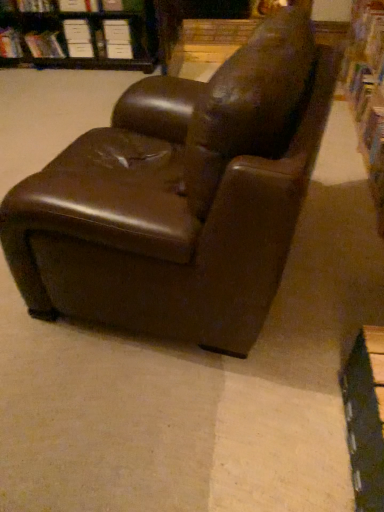
This screenshot has width=384, height=512. What do you see at coordinates (77, 31) in the screenshot?
I see `white paper at upper left, placed as the 4th paperback book when sorted from right to left` at bounding box center [77, 31].

In order to face white paper at upper left, placed as the 4th paperback book when sorted from right to left, should I rotate leftwards or rightwards?

You should look left and rotate roughly 15.010 degrees.

The height and width of the screenshot is (512, 384). Describe the element at coordinates (119, 51) in the screenshot. I see `white paper at upper center, which is the first paperback book from right to left` at that location.

Measure the distance between point (118,57) and camera.

They are 3.65 meters apart.

Where is `brown leather bookcase at upper left`? brown leather bookcase at upper left is located at coordinates (79, 34).

Image resolution: width=384 pixels, height=512 pixels. In order to click on brown leather chair at center in this screenshot , I will do `click(180, 197)`.

What is the approximate width of white paper at upper left, positioned as the 3th paperback book in right-to-left order?

white paper at upper left, positioned as the 3th paperback book in right-to-left order, is 4.79 inches wide.

This screenshot has height=512, width=384. In order to click on white paper at upper left, which is the 1th paperback book from left to right in this screenshot , I will do `click(77, 31)`.

Is brown leather bookcase at upper left taller than hardcover book at upper left, the 3th book from the front?

Yes, brown leather bookcase at upper left is taller than hardcover book at upper left, the 3th book from the front.

From the image's perspective, is brown leather bookcase at upper left below hardcover book at upper left, which appears as the 3th book when viewed from the top?

Incorrect, from the image's perspective, brown leather bookcase at upper left is higher than hardcover book at upper left, which appears as the 3th book when viewed from the top.

From a real-world perspective, is brown leather bookcase at upper left located beneath hardcover book at upper left, which appears as the 3th book when viewed from the top?

No.

Which of these two, brown leather bookcase at upper left or hardcover book at upper left, which appears as the 2th book when viewed from the left, is smaller?

hardcover book at upper left, which appears as the 2th book when viewed from the left, is smaller.

Based on their sizes in the image, would you say hardcover book at upper right, the 1th book in the bottom-to-top sequence, is bigger or smaller than brown leather bookcase at upper left?

hardcover book at upper right, the 1th book in the bottom-to-top sequence, is smaller than brown leather bookcase at upper left.

Can you confirm if hardcover book at upper right, the 1th book in the bottom-to-top sequence, is positioned to the right of brown leather bookcase at upper left?

Correct, you'll find hardcover book at upper right, the 1th book in the bottom-to-top sequence, to the right of brown leather bookcase at upper left.

Could you measure the distance between hardcover book at upper right, the first book in the front-to-back sequence, and brown leather bookcase at upper left?

6.69 feet.

What's the angular difference between hardcover book at upper right, which is the 4th book from top to bottom, and brown leather bookcase at upper left's facing directions?

The facing directions of hardcover book at upper right, which is the 4th book from top to bottom, and brown leather bookcase at upper left are 90.3 degrees apart.

Which object is wider, white paper book at upper left, arranged as the 4th book when viewed from the front, or hardcover book at upper left, the 3th book from the front?

With larger width is white paper book at upper left, arranged as the 4th book when viewed from the front.

Can you confirm if white paper book at upper left, which is counted as the second book, starting from the top, is positioned to the left of hardcover book at upper left, the 3th book from the front?

Indeed, white paper book at upper left, which is counted as the second book, starting from the top, is positioned on the left side of hardcover book at upper left, the 3th book from the front.

Which of these two, white paper book at upper left, which is counted as the second book, starting from the top, or hardcover book at upper left, the 3th book from the front, stands taller?

white paper book at upper left, which is counted as the second book, starting from the top, is taller.

Is white paper book at upper left, arranged as the 4th book when viewed from the front, facing away from hardcover book at upper left, positioned as the 2th book in back-to-front order?

white paper book at upper left, arranged as the 4th book when viewed from the front, does not have its back to hardcover book at upper left, positioned as the 2th book in back-to-front order.

Considering the relative sizes of white paper at upper left, which is the 1th paperback book from left to right, and hardcover book at upper left, which appears as the 2th book when viewed from the left, in the image provided, is white paper at upper left, which is the 1th paperback book from left to right, wider than hardcover book at upper left, which appears as the 2th book when viewed from the left,?

No, white paper at upper left, which is the 1th paperback book from left to right, is not wider than hardcover book at upper left, which appears as the 2th book when viewed from the left.

Is white paper at upper left, placed as the 4th paperback book when sorted from right to left, turned away from hardcover book at upper left, the 3th book from the front?

white paper at upper left, placed as the 4th paperback book when sorted from right to left, does not have its back to hardcover book at upper left, the 3th book from the front.

From a real-world perspective, which object rests below the other?

In real-world perspective, hardcover book at upper left, which appears as the 2th book when viewed from the left, is lower.

Is hardcover book at upper left, which appears as the second book when ordered from the bottom, located within white paper at upper left, placed as the 4th paperback book when sorted from right to left?

Definitely not — hardcover book at upper left, which appears as the second book when ordered from the bottom, is not inside white paper at upper left, placed as the 4th paperback book when sorted from right to left.

Between white paper at upper left, which is the 1th paperback book from left to right, and white paper at upper center, marked as the third paperback book in a left-to-right arrangement, which one is positioned in front?

white paper at upper center, marked as the third paperback book in a left-to-right arrangement, is more forward.

Is point (63, 24) positioned after point (116, 33)?

That is True.

Are white paper at upper left, placed as the 4th paperback book when sorted from right to left, and white paper at upper center, placed as the 2th paperback book when sorted from right to left, far apart?

That's not correct — white paper at upper left, placed as the 4th paperback book when sorted from right to left, is a little close to white paper at upper center, placed as the 2th paperback book when sorted from right to left.

Is white paper at upper center, placed as the 2th paperback book when sorted from right to left, located within white paper at upper left, placed as the 4th paperback book when sorted from right to left?

That's incorrect, white paper at upper center, placed as the 2th paperback book when sorted from right to left, is not inside white paper at upper left, placed as the 4th paperback book when sorted from right to left.

Between hardcover book at upper left, which is the third book from right to left, and brown leather chair at center, which one appears on the right side from the viewer's perspective?

Positioned to the right is brown leather chair at center.

Is hardcover book at upper left, the 3th book from the front, facing towards brown leather chair at center?

No, hardcover book at upper left, the 3th book from the front, does not turn towards brown leather chair at center.

From a real-world perspective, is hardcover book at upper left, which appears as the 3th book when viewed from the top, over brown leather chair at center?

No.

Looking at this image, can you confirm if white paper at upper center, marked as the third paperback book in a left-to-right arrangement, is taller than hardcover book at upper left, arranged as the third book when viewed from the back?

Yes, white paper at upper center, marked as the third paperback book in a left-to-right arrangement, is taller than hardcover book at upper left, arranged as the third book when viewed from the back.

How different are the orientations of white paper at upper center, placed as the 2th paperback book when sorted from right to left, and hardcover book at upper left, which appears as the second book when viewed from the front, in degrees?

2.41 degrees separate the facing orientations of white paper at upper center, placed as the 2th paperback book when sorted from right to left, and hardcover book at upper left, which appears as the second book when viewed from the front.

Is point (122, 40) more distant than point (37, 12)?

Yes, point (122, 40) is farther from viewer.

Is white paper at upper center, placed as the 2th paperback book when sorted from right to left, positioned far away from hardcover book at upper left, marked as the second book in a right-to-left arrangement?

Actually, white paper at upper center, placed as the 2th paperback book when sorted from right to left, and hardcover book at upper left, marked as the second book in a right-to-left arrangement, are a little close together.

From the image's perspective, count 2nd books downward from the brown leather bookcase at upper left and point to it. Please provide its 2D coordinates.

[(44, 45)]

In the image, there is a hardcover book at upper right, the 1th book in the bottom-to-top sequence. At what (x,y) coordinates should I click in order to perform the action: click on bookcase above it (from the image's perspective). Please return your answer as a coordinate pair (x, y). Looking at the image, I should click on 79,34.

Looking at the image, which one is located further to white paper at upper left, which is the 1th paperback book from left to right, white paper book at upper left, which is the fourth book in right-to-left order, or hardcover book at upper left, which is the third book from left to right?

white paper book at upper left, which is the fourth book in right-to-left order, is further to white paper at upper left, which is the 1th paperback book from left to right.

Looking at the image, which one is located closer to white paper at upper left, which is the second paperback book from left to right, white paper book at upper left, arranged as the 4th book when viewed from the front, or brown leather bookcase at upper left?

brown leather bookcase at upper left.

From the image, which object appears to be farther from brown leather chair at center, white paper at upper center, placed as the 2th paperback book when sorted from right to left, or white paper at upper left, which is the 1th paperback book from left to right?

white paper at upper left, which is the 1th paperback book from left to right, is further to brown leather chair at center.

Which object lies further to the anchor point hardcover book at upper left, the 1th book when ordered from top to bottom, white paper at upper left, positioned as the 3th paperback book in right-to-left order, or white paper at upper center, which is the first paperback book from right to left?

Based on the image, white paper at upper center, which is the first paperback book from right to left, appears to be further to hardcover book at upper left, the 1th book when ordered from top to bottom.

Estimate the real-world distances between objects in this image. Which object is further from brown leather bookcase at upper left, white paper book at upper left, arranged as the 4th book when viewed from the front, or white paper at upper left, which is the 1th paperback book from left to right?

white paper book at upper left, arranged as the 4th book when viewed from the front, lies further to brown leather bookcase at upper left than the other object.

Looking at the image, which one is located further to hardcover book at upper right, which ranks as the 4th book in left-to-right order, white paper book at upper left, which is counted as the first book, starting from the back, or white paper at upper center, placed as the 2th paperback book when sorted from right to left?

white paper book at upper left, which is counted as the first book, starting from the back, lies further to hardcover book at upper right, which ranks as the 4th book in left-to-right order, than the other object.

Looking at the image, which one is located closer to white paper book at upper left, arranged as the 4th book when viewed from the front, brown leather bookcase at upper left or hardcover book at upper left, arranged as the third book when viewed from the back?

hardcover book at upper left, arranged as the third book when viewed from the back, lies closer to white paper book at upper left, arranged as the 4th book when viewed from the front, than the other object.

Considering their positions, is white paper at upper left, which is the second paperback book from left to right, positioned closer to brown leather bookcase at upper left than white paper at upper center, marked as the third paperback book in a left-to-right arrangement?

white paper at upper left, which is the second paperback book from left to right, is closer to brown leather bookcase at upper left.

Identify the location of bookcase located between white paper book at upper left, arranged as the 1th book when viewed from the left, and white paper at upper left, positioned as the 3th paperback book in right-to-left order, in the left-right direction. (79, 34).

Identify the location of book positioned between brown leather chair at center and brown leather bookcase at upper left from near to far. (364, 104).

Locate an element on the screen. The image size is (384, 512). book situated between hardcover book at upper left, positioned as the 2th book in back-to-front order, and white paper at upper center, placed as the 2th paperback book when sorted from right to left, from left to right is located at coordinates (35, 6).

Image resolution: width=384 pixels, height=512 pixels. What are the coordinates of `book between hardcover book at upper left, which appears as the second book when ordered from the bottom, and hardcover book at upper right, acting as the fourth book starting from the back, in the horizontal direction` in the screenshot? It's located at (35, 6).